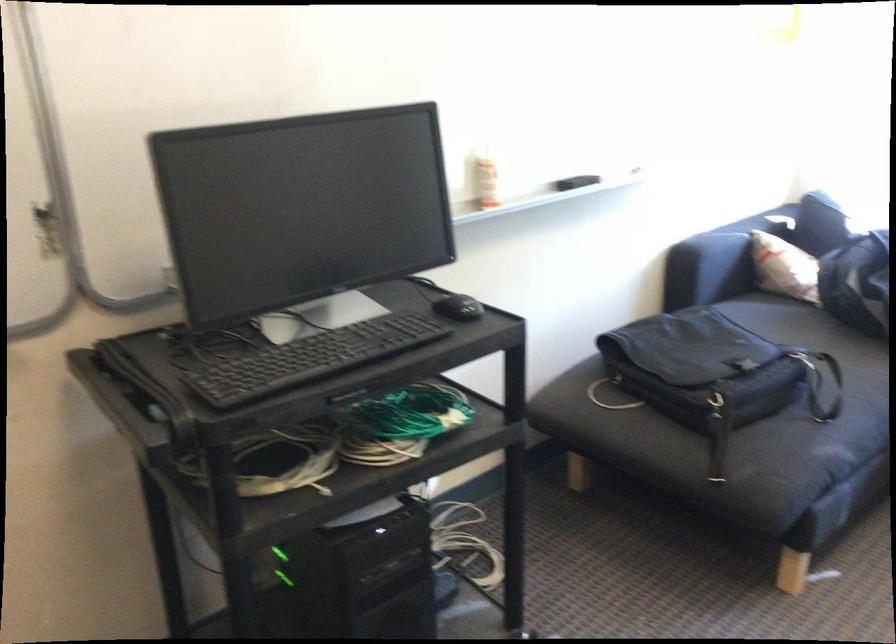
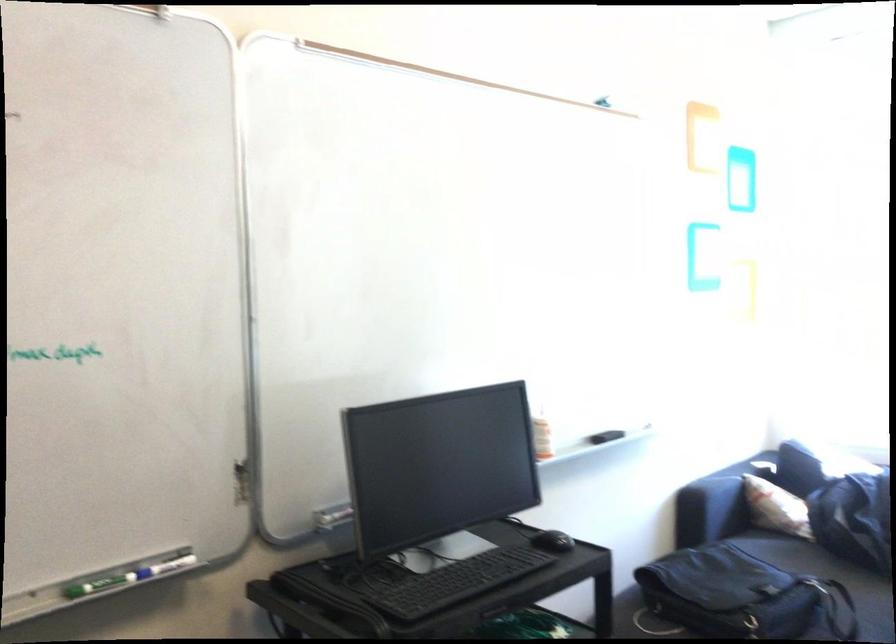
Which direction would the cameraman need to move to produce the second image?

The cameraman moved toward left, backward.